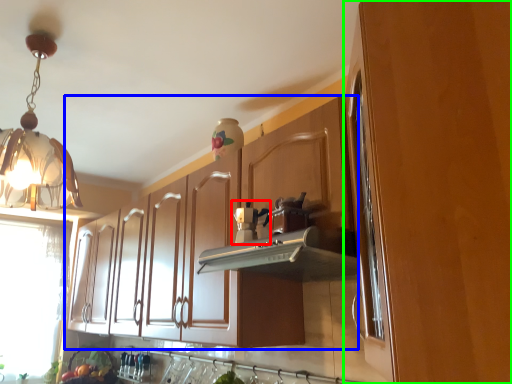
Question: Which object is positioned closest to coffee machine (highlighted by a red box)? Select from cabinetry (highlighted by a blue box) and cabinetry (highlighted by a green box).

Choices:
 (A) cabinetry
 (B) cabinetry

Answer: (A)